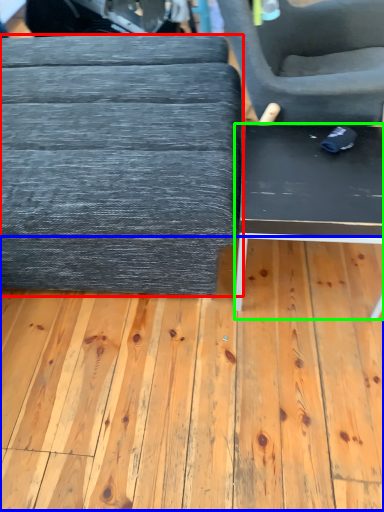
Question: Which is farther away from table (highlighted by a red box)? plywood (highlighted by a blue box) or table (highlighted by a green box)?

Choices:
 (A) plywood
 (B) table

Answer: (A)